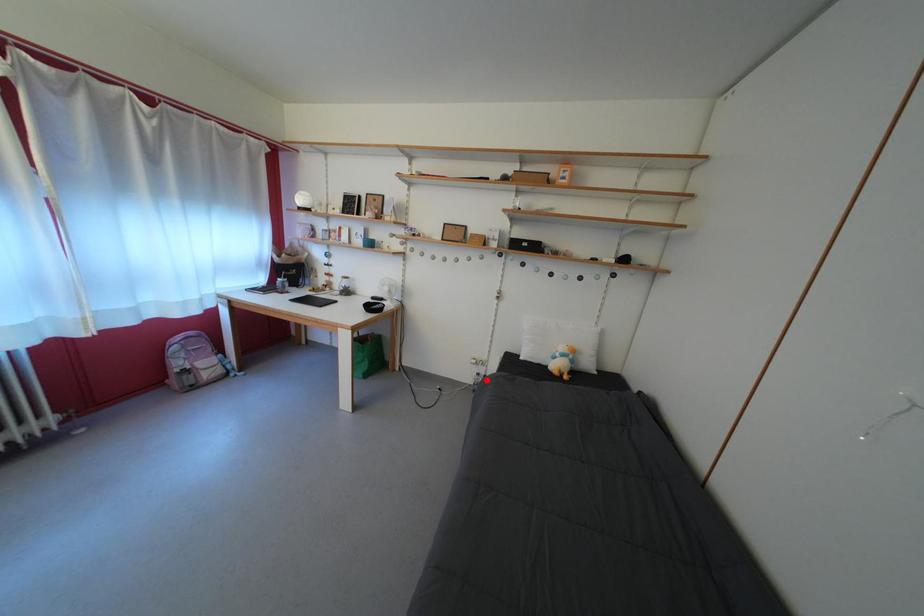
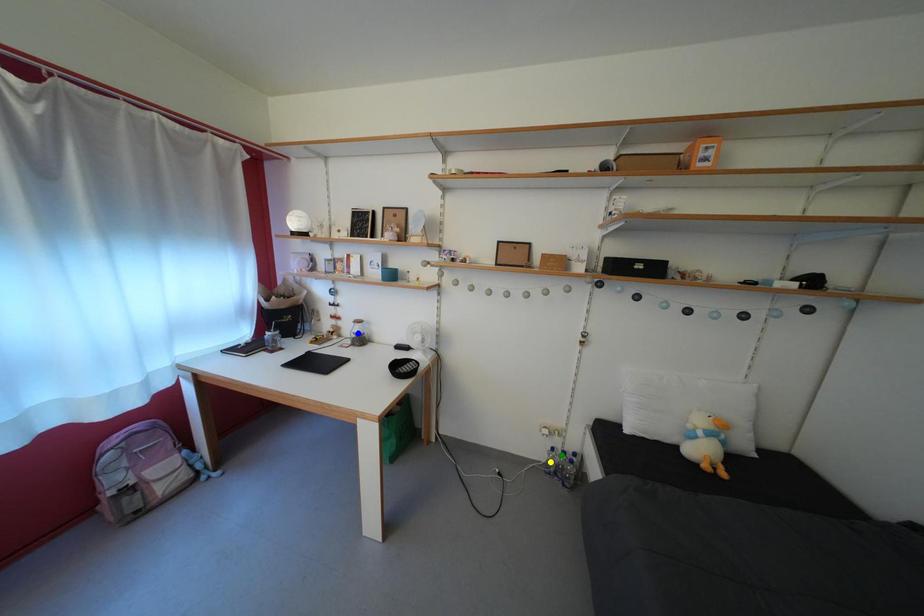
Question: I am providing you with two images of the same scene from different viewpoints. A red point is marked on the first image. You are given multiple points on the second image. Can you choose the point in image 2 that corresponds to the point in image 1?

Choices:
 (A) yellow point
 (B) green point
 (C) blue point

Answer: (B)